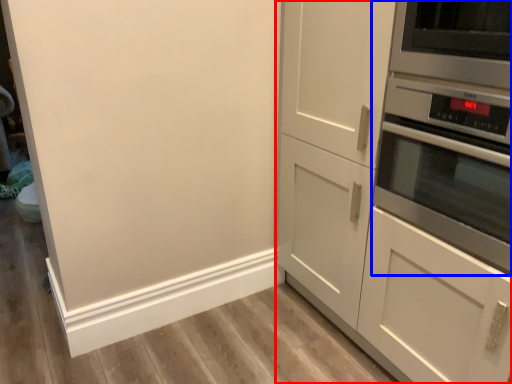
Question: Which of the following is the farthest to the observer, cabinetry (highlighted by a red box) or home appliance (highlighted by a blue box)?

Choices:
 (A) cabinetry
 (B) home appliance

Answer: (B)